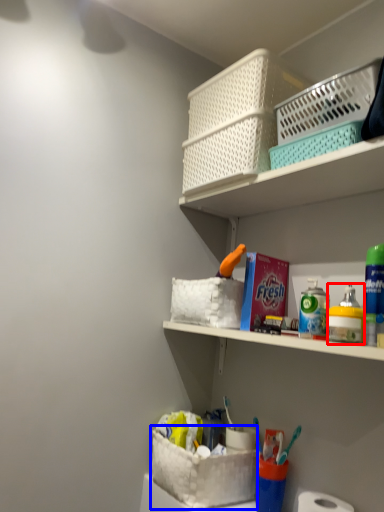
Question: Which object is closer to the camera taking this photo, toiletry (highlighted by a red box) or basket container (highlighted by a blue box)?

Choices:
 (A) toiletry
 (B) basket container

Answer: (A)